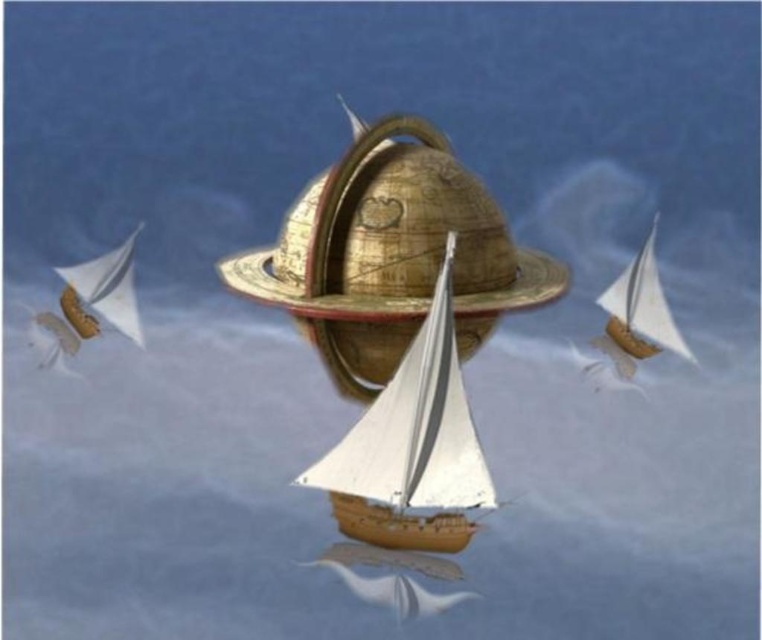
Does point (396, 154) come in front of point (444, 396)?

No.

At what (x,y) coordinates should I click in order to perform the action: click on gold metallic globe at center. Please return your answer as a coordinate pair (x, y). Image resolution: width=762 pixels, height=640 pixels. Looking at the image, I should click on (392, 237).